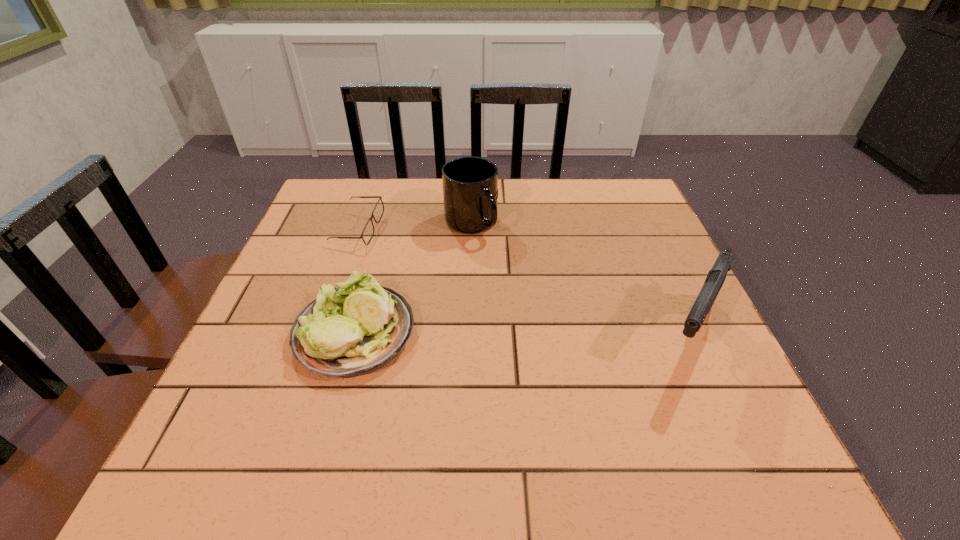
Where is `vacant area between the rightmost object and the second object from right to left`? This screenshot has width=960, height=540. vacant area between the rightmost object and the second object from right to left is located at coordinates (580, 279).

Identify the location of empty space between the gun and the mug. (580, 279).

You are a GUI agent. You are given a task and a screenshot of the screen. Output one action in this format:
    pyautogui.click(x=<x>, y=<y>)
    Task: Click on the free space between the shortest object and the rightmost object
    The width and height of the screenshot is (960, 540).
    Given the screenshot: What is the action you would take?
    pyautogui.click(x=523, y=282)

The width and height of the screenshot is (960, 540). I want to click on vacant area that lies between the mug and the rightmost object, so click(580, 279).

This screenshot has height=540, width=960. Identify the location of free space between the spectacles and the rightmost object. point(523,282).

Locate an element on the screen. This screenshot has height=540, width=960. unoccupied area between the second shortest object and the second object from right to left is located at coordinates (413, 278).

Where is `free space between the third tallest object and the gun`? free space between the third tallest object and the gun is located at coordinates (521, 335).

The image size is (960, 540). I want to click on empty location between the third object from left to right and the shortest object, so click(415, 226).

What are the coordinates of `object that is the third closest to the shortest object` in the screenshot? It's located at (716, 276).

Point out which object is positioned as the second nearest to the third object from left to right. Please provide its 2D coordinates. Your answer should be formatted as a tuple, i.e. [(x, y)], where the tuple contains the x and y coordinates of a point satisfying the conditions above.

[(353, 330)]